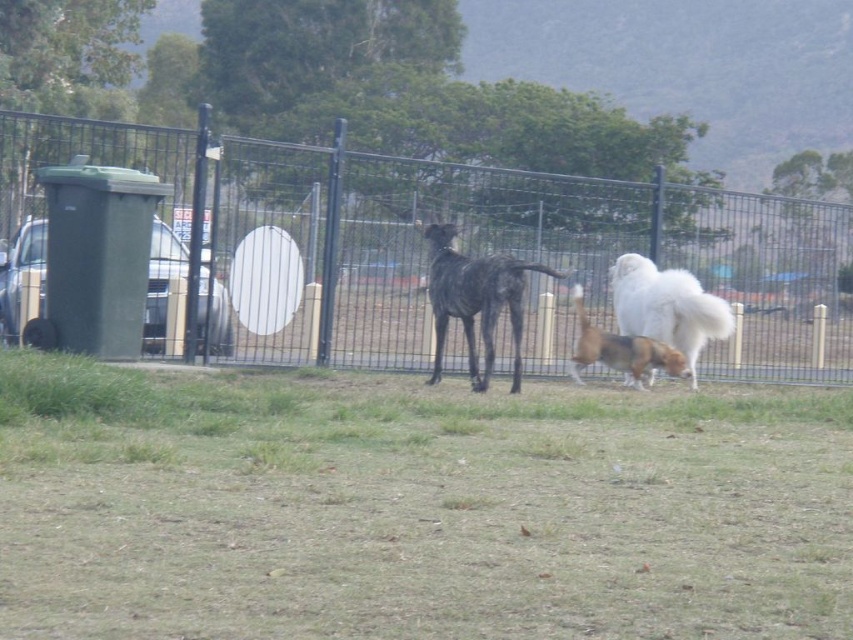
You are standing in the fenced area and want to see the trees in the background. Which object between the black metal fence at center and the brown and white fur at center is closer to you, blocking your view?

The brown and white fur at center is closer to you than the black metal fence at center, so it is blocking your view of the trees in the background.

You are standing in a field and want to take a photo of the black metal fence at center. If your camera has a maximum focus range of 15 meters, will it be able to focus on the fence?

The distance between the black metal fence at center and the camera is 15.15 meters, which exceeds the camera maximum focus range of 15 meters. Therefore, the camera cannot focus on the fence.

You are standing in the fenced area and want to place a small flag at each of the two points, point (705,316) and point (581,332). Which point is closer to you so that the flag will be more visible?

Point (705,316) is closer to the camera than point (581,332), so the flag placed at point (705,316) will be more visible.